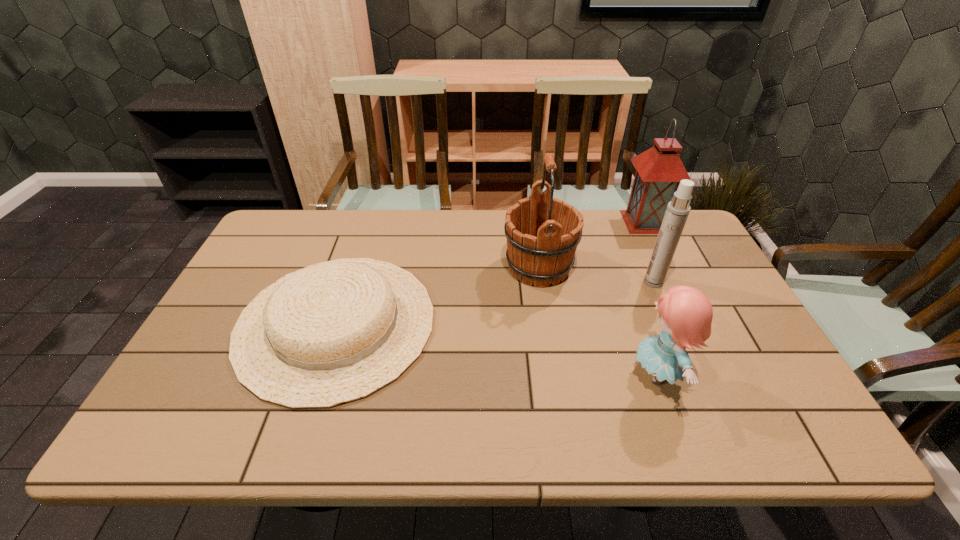
This screenshot has height=540, width=960. Identify the location of lantern. (659, 170).

At what (x,y) coordinates should I click in order to perform the action: click on wine bucket. Please return your answer as a coordinate pair (x, y). Image resolution: width=960 pixels, height=540 pixels. Looking at the image, I should click on (542, 232).

Where is `aerosol can`? This screenshot has width=960, height=540. aerosol can is located at coordinates (678, 209).

Find the location of a particular element. The height and width of the screenshot is (540, 960). doll is located at coordinates (686, 314).

Locate an element on the screen. Image resolution: width=960 pixels, height=540 pixels. the leftmost object is located at coordinates (333, 332).

Find the location of a particular element. This screenshot has width=960, height=540. the shortest object is located at coordinates (333, 332).

You are a GUI agent. You are given a task and a screenshot of the screen. Output one action in this format:
    pyautogui.click(x=<x>, y=<y>)
    Task: Click on the vacant space situated 0.050m on the left of the lantern
    The width and height of the screenshot is (960, 540).
    Given the screenshot: What is the action you would take?
    pyautogui.click(x=609, y=222)

Identify the location of blank space located on the front of the wine bucket. (550, 341).

In order to click on vacant region located on the front of the aerosol can in this screenshot , I will do `click(673, 328)`.

The width and height of the screenshot is (960, 540). In order to click on vacant space located 0.270m on the front-facing side of the fourth tallest object in this screenshot , I will do `click(516, 374)`.